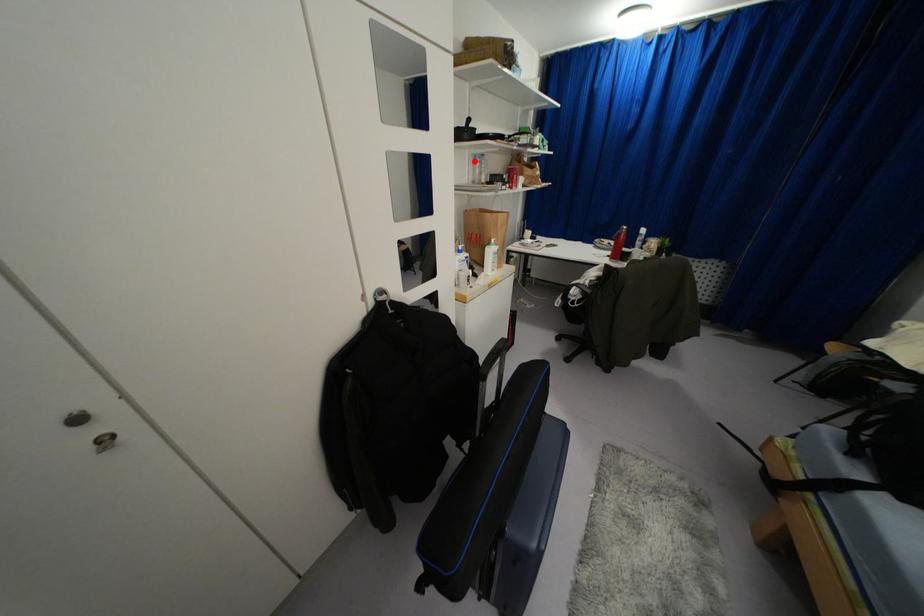
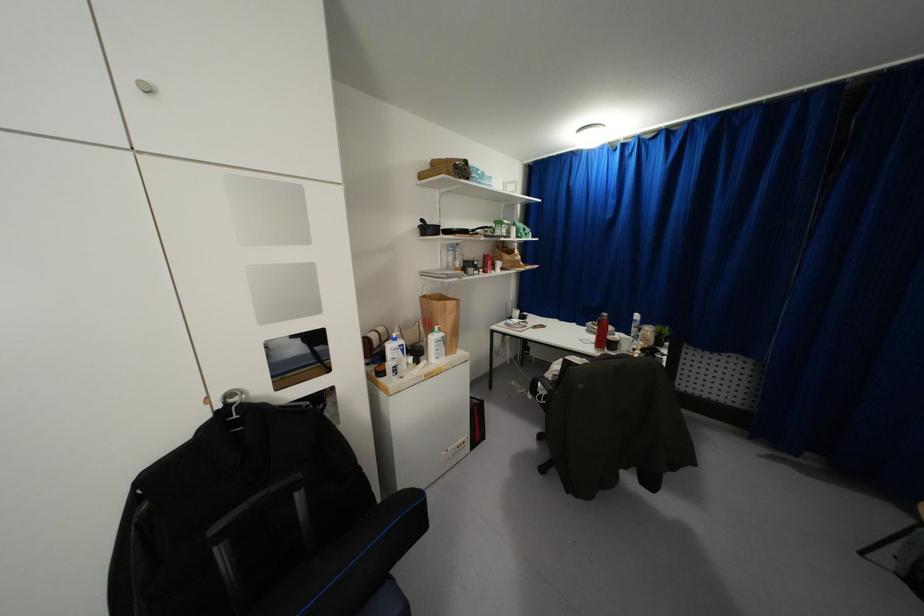
The point at the highlighted location is marked in the first image. Where is the corresponding point in the second image?

(446, 249)